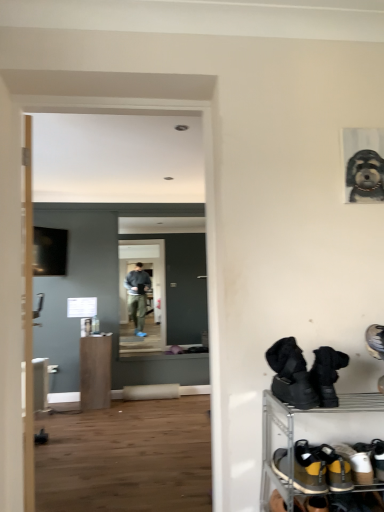
Question: Looking at the image, does brown suede shoes at lower right, the second footwear viewed from the top, seem bigger or smaller compared to black rubber boots at lower right?

Choices:
 (A) big
 (B) small

Answer: (B)

Question: In the image, is brown suede shoes at lower right, the second footwear viewed from the top, positioned in front of or behind black rubber boots at lower right?

Choices:
 (A) behind
 (B) front

Answer: (A)

Question: Estimate the real-world distances between objects in this image. Which object is farther from the gray textured dog portrait at upper right?

Choices:
 (A) brown suede shoes at lower right, the second footwear viewed from the top
 (B) black suede boots at lower right, arranged as the first footwear when viewed from the top
 (C) black rubber boots at lower right
 (D) transparent glass door at center
 (E) yellow suede sneakers at lower right, which is the third footwear from top to bottom

Answer: (D)

Question: Based on their relative distances, which object is nearer to the matte brown cabinet at center?

Choices:
 (A) gray textured dog portrait at upper right
 (B) black rubber boots at lower right
 (C) brown suede shoes at lower right, the second footwear viewed from the top
 (D) yellow suede sneakers at lower right, which is the third footwear from top to bottom
 (E) black suede boots at lower right, which is the third footwear from bottom to top

Answer: (B)